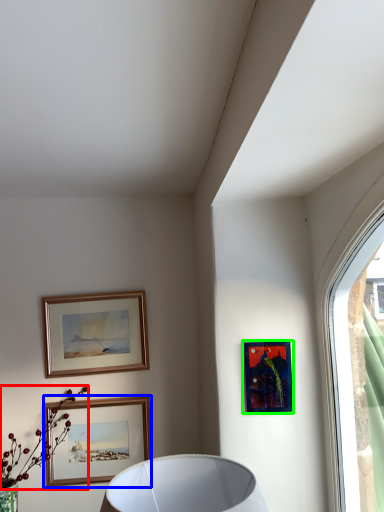
Question: Which object is positioned farthest from flower (highlighted by a red box)? Select from picture frame (highlighted by a blue box) and picture frame (highlighted by a green box).

Choices:
 (A) picture frame
 (B) picture frame

Answer: (B)